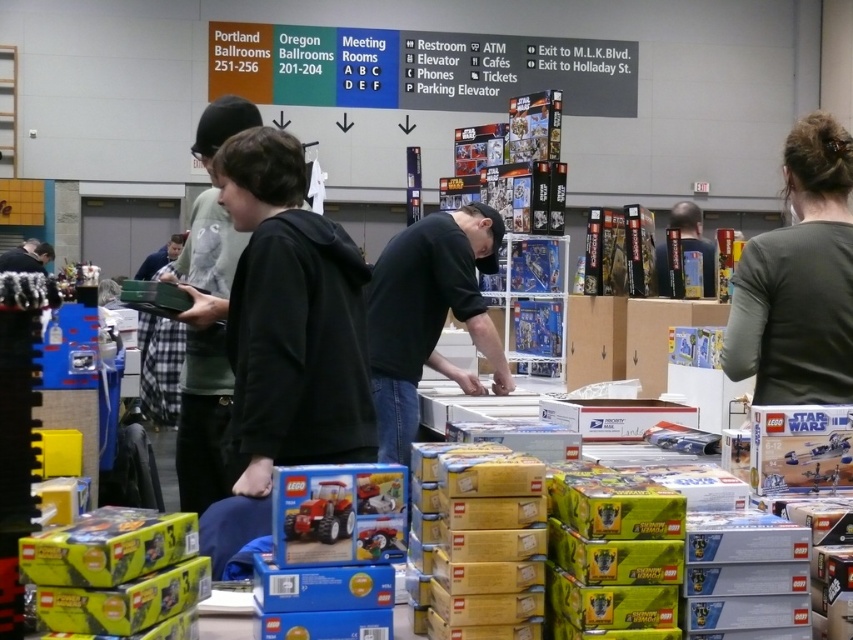
Looking at this image, you are standing at the entrance of the convention center and see two points in the image. The first point is at coordinate point (708, 292) and the second point is at coordinate point (10, 253). Which point is closer to you?

Point (708, 292) is closer to the camera than point (10, 253).